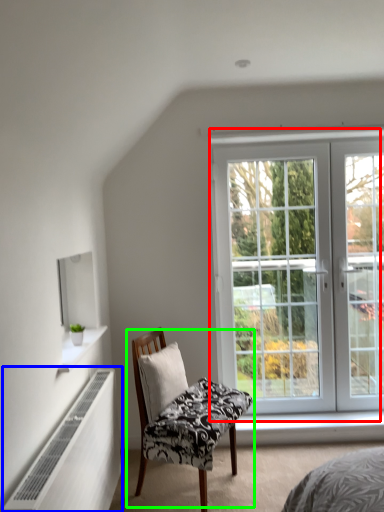
Question: Which object is positioned closest to window (highlighted by a red box)? Select from radiator (highlighted by a blue box) and chair (highlighted by a green box).

Choices:
 (A) radiator
 (B) chair

Answer: (B)